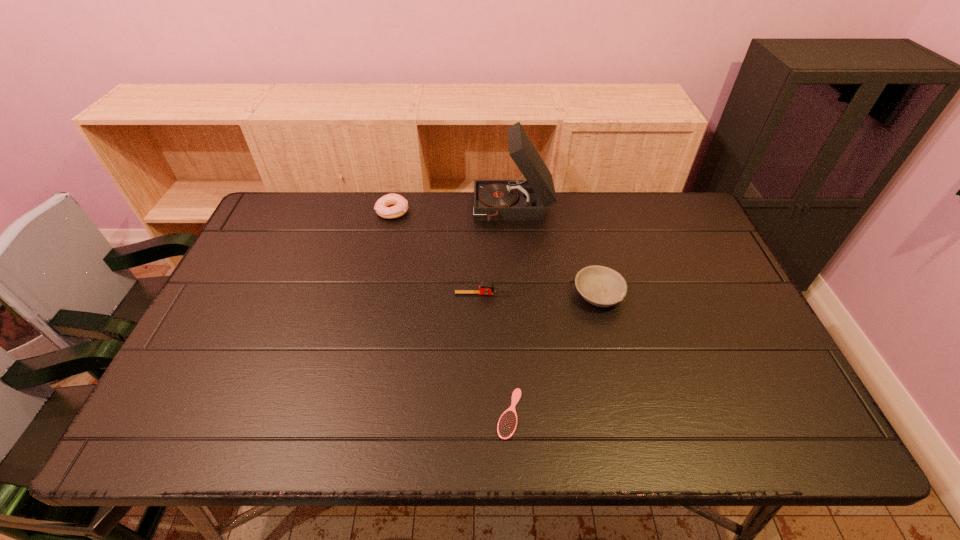
You are a GUI agent. You are given a task and a screenshot of the screen. Output one action in this format:
    pyautogui.click(x=<x>, y=<y>)
    Task: Click on the phonograph_record
    The width and height of the screenshot is (960, 540).
    Given the screenshot: What is the action you would take?
    pyautogui.click(x=494, y=200)

Find the location of a particular element. This screenshot has width=960, height=540. the leftmost object is located at coordinates [400, 207].

Image resolution: width=960 pixels, height=540 pixels. Find the location of `the rightmost object`. the rightmost object is located at coordinates (601, 286).

Where is `tape measure`? This screenshot has width=960, height=540. tape measure is located at coordinates (485, 288).

The image size is (960, 540). I want to click on hairbrush, so click(507, 424).

The image size is (960, 540). I want to click on the nearest object, so click(x=507, y=424).

Where is `blank space located on the front-facing side of the phonograph_record`? blank space located on the front-facing side of the phonograph_record is located at coordinates (408, 210).

This screenshot has width=960, height=540. I want to click on free space located 0.380m on the front-facing side of the phonograph_record, so click(360, 210).

Find the location of a particular element. This screenshot has height=540, width=960. vacant point located 0.110m on the front-facing side of the phonograph_record is located at coordinates (441, 210).

Where is `free location located on the left of the doughnut`? The width and height of the screenshot is (960, 540). free location located on the left of the doughnut is located at coordinates (309, 212).